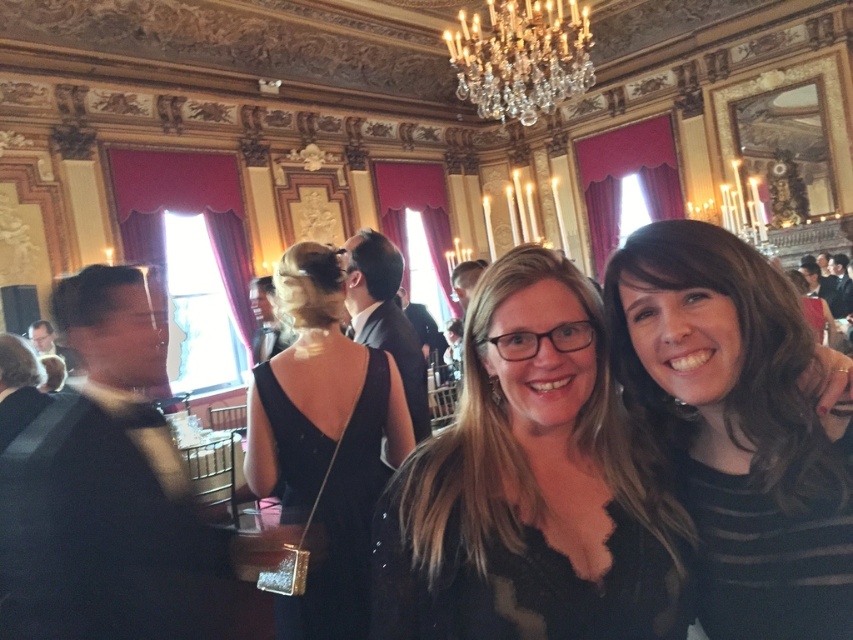
Question: Is black striped shirt at right bigger than crystal glass chandelier at upper center?

Choices:
 (A) no
 (B) yes

Answer: (A)

Question: Which point is farther to the camera?

Choices:
 (A) (302, 465)
 (B) (618, 557)

Answer: (A)

Question: Which is nearer to the matte black dress at center?

Choices:
 (A) black striped shirt at right
 (B) black velvet dress at center
 (C) crystal glass chandelier at upper center

Answer: (A)

Question: Observing the image, what is the correct spatial positioning of matte black dress at center in reference to black velvet dress at center?

Choices:
 (A) right
 (B) left

Answer: (A)

Question: Is matte black dress at center wider than black striped shirt at right?

Choices:
 (A) no
 (B) yes

Answer: (B)

Question: Which object is closer to the camera taking this photo?

Choices:
 (A) black velvet dress at center
 (B) crystal glass chandelier at upper center
 (C) matte black dress at center
 (D) black striped shirt at right

Answer: (D)